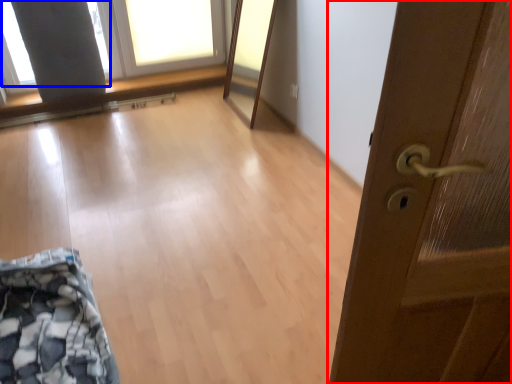
Question: Among these objects, which one is nearest to the camera, door (highlighted by a red box) or window screen (highlighted by a blue box)?

Choices:
 (A) door
 (B) window screen

Answer: (A)